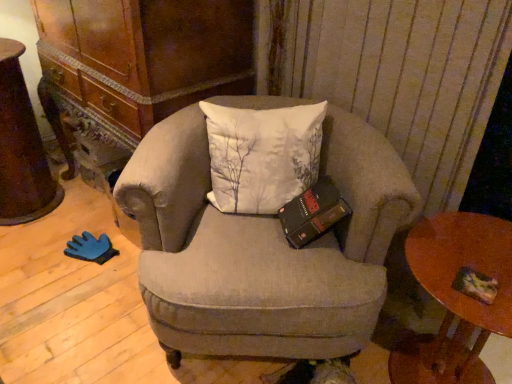
Image resolution: width=512 pixels, height=384 pixels. Describe the element at coordinates (262, 248) in the screenshot. I see `textured beige armchair at center` at that location.

Measure the distance between multicolored paper at lower right and camera.

38.90 inches.

The width and height of the screenshot is (512, 384). What do you see at coordinates (475, 285) in the screenshot? I see `multicolored paper at lower right` at bounding box center [475, 285].

Find the location of a particular element. The height and width of the screenshot is (384, 512). textured beige armchair at center is located at coordinates (262, 248).

Which is behind, point (475, 345) or point (23, 164)?

The point (23, 164) is more distant.

Is rustic wood desk at left at the back of wooden round table at lower right?

No, wooden round table at lower right's orientation is not away from rustic wood desk at left.

Would you say wooden round table at lower right is inside or outside rustic wood desk at left?

wooden round table at lower right lies outside rustic wood desk at left.

From the image's perspective, is wooden round table at lower right over rustic wood desk at left?

Incorrect, from the image's perspective, wooden round table at lower right is lower than rustic wood desk at left.

From a real-world perspective, which is physically above, multicolored paper at lower right or rustic wood desk at left?

multicolored paper at lower right.

Considering the relative sizes of multicolored paper at lower right and rustic wood desk at left in the image provided, is multicolored paper at lower right taller than rustic wood desk at left?

Incorrect, the height of multicolored paper at lower right is not larger of that of rustic wood desk at left.

From the image's perspective, would you say multicolored paper at lower right is shown under rustic wood desk at left?

Indeed, from the image's perspective, multicolored paper at lower right is shown beneath rustic wood desk at left.

From the image's perspective, is wooden round table at lower right located above textured beige armchair at center?

No, from the image's perspective, wooden round table at lower right is not on top of textured beige armchair at center.

Can you confirm if wooden round table at lower right is bigger than textured beige armchair at center?

Actually, wooden round table at lower right might be smaller than textured beige armchair at center.

Can we say wooden round table at lower right lies outside textured beige armchair at center?

That's correct, wooden round table at lower right is outside of textured beige armchair at center.

Is wooden round table at lower right turned away from textured beige armchair at center?

No, wooden round table at lower right is not facing the opposite direction of textured beige armchair at center.

Is point (149, 229) positioned before point (17, 84)?

Yes, it is.

Is textured beige armchair at center oriented towards rustic wood desk at left?

No, textured beige armchair at center is not facing towards rustic wood desk at left.

Choose the correct answer: Is textured beige armchair at center inside rustic wood desk at left or outside it?

textured beige armchair at center cannot be found inside rustic wood desk at left.

From a real-world perspective, which is physically above, textured beige armchair at center or rustic wood desk at left?

In real-world perspective, rustic wood desk at left is above.

From a real-world perspective, which object stands above the other?

In real-world perspective, multicolored paper at lower right is above.

Looking at their sizes, would you say wooden round table at lower right is wider or thinner than multicolored paper at lower right?

Considering their sizes, wooden round table at lower right looks broader than multicolored paper at lower right.

Locate an element on the screen. This screenshot has width=512, height=384. table that appears below the multicolored paper at lower right (from the image's perspective) is located at coordinates (456, 297).

Considering the relative sizes of textured beige armchair at center and multicolored paper at lower right in the image provided, is textured beige armchair at center bigger than multicolored paper at lower right?

Correct, textured beige armchair at center is larger in size than multicolored paper at lower right.

In the scene shown: How many degrees apart are the facing directions of textured beige armchair at center and multicolored paper at lower right?

The facing directions of textured beige armchair at center and multicolored paper at lower right are 38.2 degrees apart.

Which point is more forward, [354,116] or [462,282]?

Point [462,282]

Looking at this image, which object is thinner, textured beige armchair at center or multicolored paper at lower right?

multicolored paper at lower right.

Which of these two, rustic wood desk at left or textured beige armchair at center, is thinner?

rustic wood desk at left is thinner.

In the scene shown: Are rustic wood desk at left and textured beige armchair at center far apart?

Yes, rustic wood desk at left is far from textured beige armchair at center.

Is rustic wood desk at left situated inside textured beige armchair at center or outside?

rustic wood desk at left is spatially situated outside textured beige armchair at center.

Between rustic wood desk at left and textured beige armchair at center, which one appears on the right side from the viewer's perspective?

textured beige armchair at center is more to the right.

At what (x,y) coordinates should I click in order to perform the action: click on table that appears below the rustic wood desk at left (from the image's perspective). Please return your answer as a coordinate pair (x, y). The height and width of the screenshot is (384, 512). Looking at the image, I should click on (456, 297).

I want to click on desk behind the multicolored paper at lower right, so click(21, 148).

From the picture: From the image, which object appears to be farther from rustic wood desk at left, textured beige armchair at center or wooden round table at lower right?

Based on the image, wooden round table at lower right appears to be further to rustic wood desk at left.

Estimate the real-world distances between objects in this image. Which object is closer to textured beige armchair at center, rustic wood desk at left or multicolored paper at lower right?

multicolored paper at lower right is closer to textured beige armchair at center.

Estimate the real-world distances between objects in this image. Which object is closer to textured beige armchair at center, multicolored paper at lower right or rustic wood desk at left?

The object closer to textured beige armchair at center is multicolored paper at lower right.

From the image, which object appears to be nearer to multicolored paper at lower right, textured beige armchair at center or rustic wood desk at left?

textured beige armchair at center.

When comparing their distances from wooden round table at lower right, does textured beige armchair at center or rustic wood desk at left seem further?

Answer: Among the two, rustic wood desk at left is located further to wooden round table at lower right.

Based on their spatial positions, is wooden round table at lower right or rustic wood desk at left further from multicolored paper at lower right?

The object further to multicolored paper at lower right is rustic wood desk at left.

Looking at this image, estimate the real-world distances between objects in this image. Which object is closer to textured beige armchair at center, wooden round table at lower right or rustic wood desk at left?

The object closer to textured beige armchair at center is wooden round table at lower right.

Estimate the real-world distances between objects in this image. Which object is further from multicolored paper at lower right, textured beige armchair at center or wooden round table at lower right?

textured beige armchair at center.

You are a GUI agent. You are given a task and a screenshot of the screen. Output one action in this format:
    pyautogui.click(x=<x>, y=<y>)
    Task: Click on the paperback book between textured beige armchair at center and wooden round table at lower right from left to right
    
    Given the screenshot: What is the action you would take?
    pyautogui.click(x=475, y=285)

Find the location of a particular element. Image resolution: width=512 pixels, height=384 pixels. paperback book located between rustic wood desk at left and wooden round table at lower right in the left-right direction is located at coordinates (475, 285).

Image resolution: width=512 pixels, height=384 pixels. Identify the location of chair between rustic wood desk at left and wooden round table at lower right in the horizontal direction. (262, 248).

The image size is (512, 384). In order to click on chair between rustic wood desk at left and multicolored paper at lower right in this screenshot , I will do `click(262, 248)`.